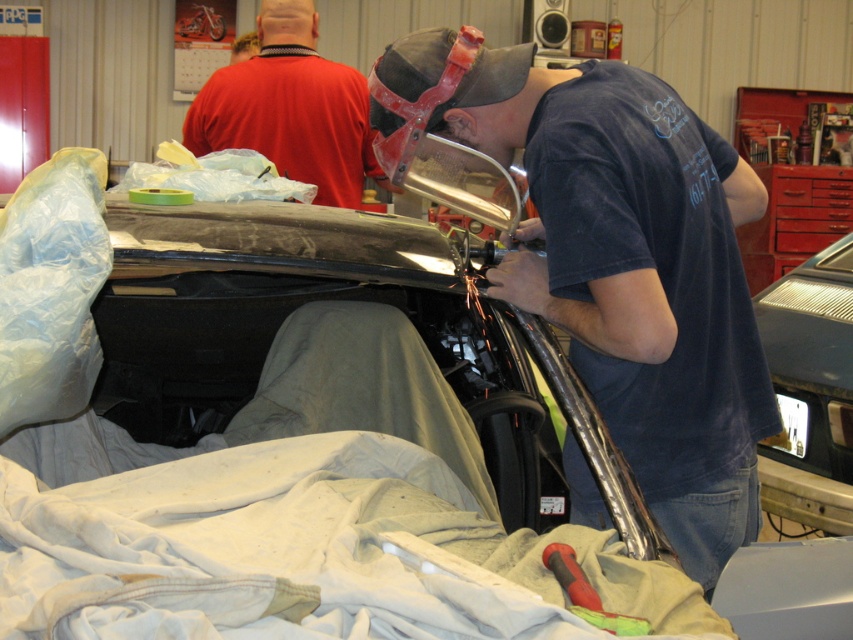
You are a mechanic working in the workshop and need to access the metallic silver car at lower right. Is the red matte shirt at upper center blocking your path to the car?

The metallic silver car at lower right is behind the red matte shirt at upper center, so the shirt is blocking the path to the car.

You are a safety inspector standing in the workshop and need to check the distance between the matte black helmet at center and the viewer. According to safety regulations, the minimum safe distance for operating a grinder near a helmet is 5 feet. Is the current distance compliant with safety standards?

The matte black helmet at center and viewer are 4.79 feet apart from each other, which is less than the required 5 feet. Therefore, the current distance does not comply with safety standards.